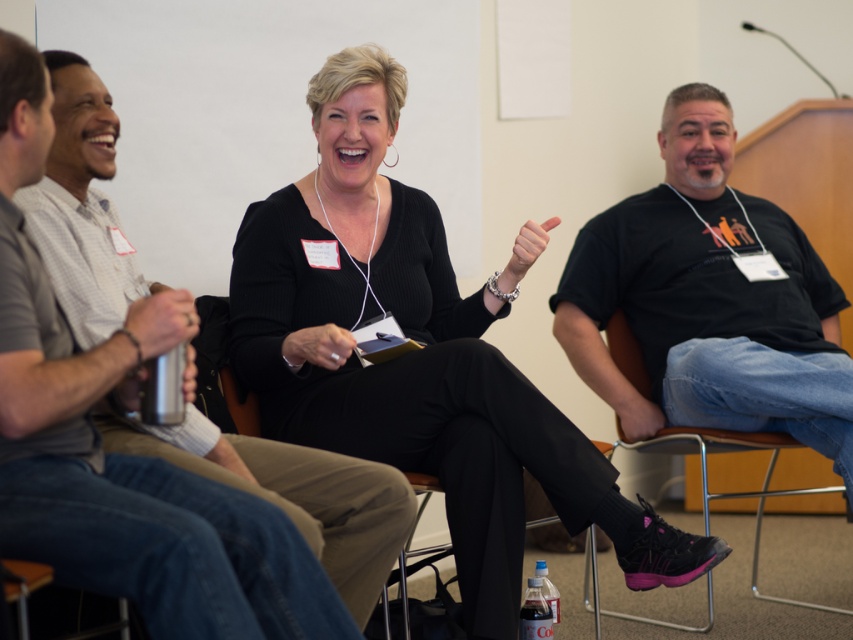
Between black cotton t-shirt at right and metallic silver chair at lower right, which one has less height?

With less height is metallic silver chair at lower right.

Between point (711, 300) and point (698, 435), which one is positioned behind?

The point (711, 300) is behind.

Which is behind, point (680, 397) or point (683, 440)?

The point (683, 440) is more distant.

This screenshot has width=853, height=640. Find the location of `black cotton t-shirt at right`. black cotton t-shirt at right is located at coordinates (708, 300).

The height and width of the screenshot is (640, 853). What are the coordinates of `matte silver water bottle at left` in the screenshot? It's located at (122, 454).

Is point (83, 396) farther from viewer compared to point (699, 314)?

No, it is in front of (699, 314).

Is point (30, 384) farther from viewer compared to point (660, 369)?

No, (30, 384) is closer to viewer.

Locate an element on the screen. This screenshot has height=640, width=853. matte silver water bottle at left is located at coordinates (122, 454).

You are a GUI agent. You are given a task and a screenshot of the screen. Output one action in this format:
    pyautogui.click(x=<x>, y=<y>)
    Task: Click on the black cotton t-shirt at right
    This screenshot has width=853, height=640.
    Given the screenshot: What is the action you would take?
    pyautogui.click(x=708, y=300)

Measure the distance between black cotton t-shirt at right and camera.

black cotton t-shirt at right and camera are 2.55 meters apart from each other.

Which is in front, point (668, 291) or point (398, 570)?

Point (398, 570)

You are a GUI agent. You are given a task and a screenshot of the screen. Output one action in this format:
    pyautogui.click(x=<x>, y=<y>)
    Task: Click on the black cotton t-shirt at right
    Image resolution: width=853 pixels, height=640 pixels.
    Given the screenshot: What is the action you would take?
    pyautogui.click(x=708, y=300)